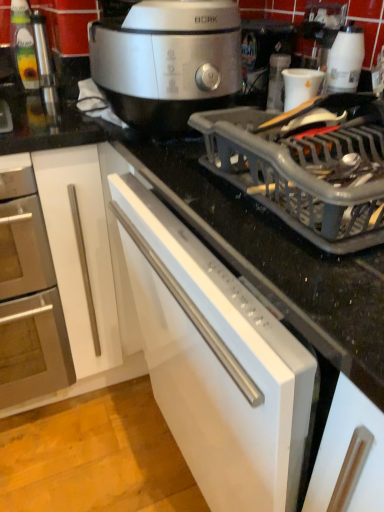
Question: Should I look upward or downward to see brushed metal oven at left?

Choices:
 (A) down
 (B) up

Answer: (A)

Question: Is white plastic coffee machine at upper right looking in the opposite direction of brushed metal oven at left?

Choices:
 (A) no
 (B) yes

Answer: (A)

Question: Is brushed metal oven at left completely or partially inside white plastic coffee machine at upper right?

Choices:
 (A) yes
 (B) no

Answer: (B)

Question: Considering the relative sizes of white plastic coffee machine at upper right and brushed metal oven at left in the image provided, is white plastic coffee machine at upper right shorter than brushed metal oven at left?

Choices:
 (A) yes
 (B) no

Answer: (A)

Question: From the image's perspective, is white plastic coffee machine at upper right located beneath brushed metal oven at left?

Choices:
 (A) no
 (B) yes

Answer: (A)

Question: Is white plastic coffee machine at upper right closer to the viewer compared to brushed metal oven at left?

Choices:
 (A) yes
 (B) no

Answer: (B)

Question: Does white plastic coffee machine at upper right lie behind brushed metal oven at left?

Choices:
 (A) no
 (B) yes

Answer: (B)

Question: Is satin silver slow cooker at upper center next to white glossy cup at upper right?

Choices:
 (A) no
 (B) yes

Answer: (A)

Question: From the image's perspective, is satin silver slow cooker at upper center on top of white glossy cup at upper right?

Choices:
 (A) yes
 (B) no

Answer: (A)

Question: Is the position of satin silver slow cooker at upper center less distant than that of white glossy cup at upper right?

Choices:
 (A) yes
 (B) no

Answer: (A)

Question: Is satin silver slow cooker at upper center further to the viewer compared to white glossy cup at upper right?

Choices:
 (A) no
 (B) yes

Answer: (A)

Question: Considering the relative positions of satin silver slow cooker at upper center and white glossy cup at upper right in the image provided, is satin silver slow cooker at upper center to the right of white glossy cup at upper right from the viewer's perspective?

Choices:
 (A) no
 (B) yes

Answer: (A)

Question: Considering the relative sizes of satin silver slow cooker at upper center and white glossy cup at upper right in the image provided, is satin silver slow cooker at upper center thinner than white glossy cup at upper right?

Choices:
 (A) yes
 (B) no

Answer: (B)

Question: Considering the relative sizes of white glossy cup at upper right and satin silver slow cooker at upper center in the image provided, is white glossy cup at upper right shorter than satin silver slow cooker at upper center?

Choices:
 (A) yes
 (B) no

Answer: (A)